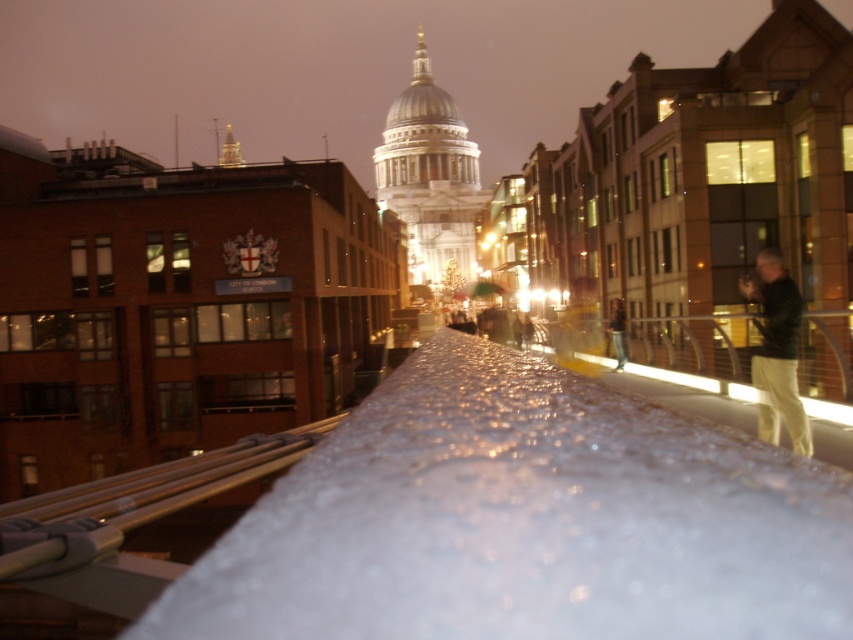
You are standing on a bridge at night and see the transparent frosted snow at center and the light brown leather jacket at right. Which object is closer to the left side of the bridge?

The transparent frosted snow at center is closer to the left side of the bridge because it is positioned to the left of the light brown leather jacket at right.

You are a photographer standing on a bridge at night. You notice a transparent frosted snow at center and a dark green jacket at right in your viewfinder. Which object would appear bigger in your photo?

The transparent frosted snow at center would appear bigger in the photo since it is larger in size than the dark green jacket at right.